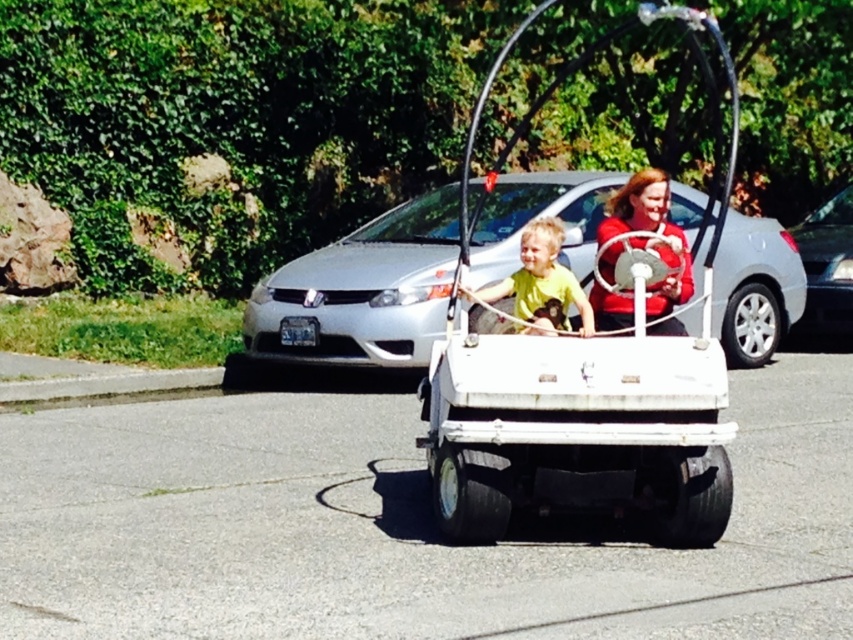
Does white matte golf cart at center appear on the right side of silver metallic sedan at center?

Incorrect, white matte golf cart at center is not on the right side of silver metallic sedan at center.

Does point (457, 513) come closer to viewer compared to point (848, 312)?

Yes, point (457, 513) is closer to viewer.

Describe the element at coordinates (578, 426) in the screenshot. The width and height of the screenshot is (853, 640). I see `white matte golf cart at center` at that location.

Find the location of a particular element. This screenshot has width=853, height=640. white matte golf cart at center is located at coordinates coord(578,426).

Can you confirm if matte red shirt at center is smaller than silver metallic sedan at center?

Correct, matte red shirt at center occupies less space than silver metallic sedan at center.

Does matte red shirt at center appear on the left side of silver metallic sedan at center?

Indeed, matte red shirt at center is positioned on the left side of silver metallic sedan at center.

Between point (660, 332) and point (834, 205), which one is positioned behind?

Point (834, 205)

Where is `matte red shirt at center`? The height and width of the screenshot is (640, 853). matte red shirt at center is located at coordinates (650, 230).

Is white matte golf cart at center positioned at the back of white matte car at center?

That is False.

Between white matte golf cart at center and white matte car at center, which one appears on the right side from the viewer's perspective?

white matte golf cart at center

Does point (735, 92) lie in front of point (421, 234)?

No, it is behind (421, 234).

What are the coordinates of `white matte golf cart at center` in the screenshot? It's located at (578, 426).